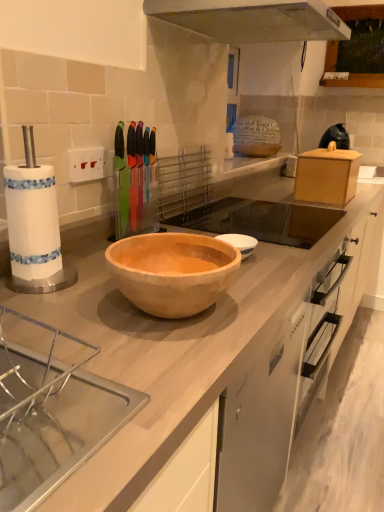
Image resolution: width=384 pixels, height=512 pixels. What do you see at coordinates (252, 19) in the screenshot? I see `stainless steel exhaust hood at upper center` at bounding box center [252, 19].

Based on the photo, what is the approximate width of stainless steel exhaust hood at upper center?

stainless steel exhaust hood at upper center is 20.89 inches in width.

What do you see at coordinates (51, 409) in the screenshot? This screenshot has height=512, width=384. I see `clear acrylic sink at lower left, marked as the 1th sink in a front-to-back arrangement` at bounding box center [51, 409].

The width and height of the screenshot is (384, 512). I want to click on stainless steel exhaust hood at upper center, so click(252, 19).

From the image's perspective, does clear acrylic sink at lower left, which is counted as the 1th sink, starting from the bottom, appear lower than stainless steel exhaust hood at upper center?

Yes, from the image's perspective, clear acrylic sink at lower left, which is counted as the 1th sink, starting from the bottom, is below stainless steel exhaust hood at upper center.

Is clear acrylic sink at lower left, which is counted as the 1th sink, starting from the bottom, thinner than stainless steel exhaust hood at upper center?

Indeed, clear acrylic sink at lower left, which is counted as the 1th sink, starting from the bottom, has a lesser width compared to stainless steel exhaust hood at upper center.

Can you confirm if clear acrylic sink at lower left, the first sink positioned from the left, is shorter than stainless steel exhaust hood at upper center?

Yes, clear acrylic sink at lower left, the first sink positioned from the left, is shorter than stainless steel exhaust hood at upper center.

In the scene shown: Which object is further away from the camera taking this photo, black plastic kettle at upper right or clear acrylic sink at lower left, marked as the 1th sink in a front-to-back arrangement?

black plastic kettle at upper right is behind.

How different are the orientations of black plastic kettle at upper right and clear acrylic sink at lower left, the second sink viewed from the back, in degrees?

The angle between the facing direction of black plastic kettle at upper right and the facing direction of clear acrylic sink at lower left, the second sink viewed from the back, is 53.5 degrees.

From the image's perspective, between black plastic kettle at upper right and clear acrylic sink at lower left, which is the second sink in right-to-left order, which one is located above?

black plastic kettle at upper right.

Is point (332, 226) closer or farther from the camera than point (60, 339)?

Clearly, point (332, 226) is more distant from the camera than point (60, 339).

You are a GUI agent. You are given a task and a screenshot of the screen. Output one action in this format:
    pyautogui.click(x=<x>, y=<y>)
    Task: Click on the sink that is under the clear acrylic sink at lower left, the first sink positioned from the left (from a real-world perspective)
    This screenshot has width=384, height=512.
    Given the screenshot: What is the action you would take?
    pyautogui.click(x=261, y=220)

Is wooden bowl at center, the 2th sink from the left, spatially inside clear acrylic sink at lower left, the first sink positioned from the left, or outside of it?

wooden bowl at center, the 2th sink from the left, is not inside clear acrylic sink at lower left, the first sink positioned from the left, it's outside.

From the image's perspective, which one is positioned higher, stainless steel exhaust hood at upper center or wooden bowl at center, the first sink in the right-to-left sequence?

stainless steel exhaust hood at upper center is shown above in the image.

Based on the photo, how different are the orientations of stainless steel exhaust hood at upper center and wooden bowl at center, arranged as the first sink when viewed from the top, in degrees?

The facing directions of stainless steel exhaust hood at upper center and wooden bowl at center, arranged as the first sink when viewed from the top, are 0.0707 degrees apart.

Could you tell me if stainless steel exhaust hood at upper center is facing wooden bowl at center, which ranks as the first sink in back-to-front order?

No.

Considering the points (204, 10) and (294, 223), which point is behind, point (204, 10) or point (294, 223)?

The point (294, 223) is behind.

How different are the orientations of clear acrylic sink at lower left, which is counted as the 2th sink, starting from the top, and wooden bowl at center, which ranks as the first sink in back-to-front order, in degrees?

The angle between the facing direction of clear acrylic sink at lower left, which is counted as the 2th sink, starting from the top, and the facing direction of wooden bowl at center, which ranks as the first sink in back-to-front order, is 0.595 degrees.

Considering the sizes of objects clear acrylic sink at lower left, the second sink viewed from the back, and wooden bowl at center, the second sink from the front, in the image provided, who is taller, clear acrylic sink at lower left, the second sink viewed from the back, or wooden bowl at center, the second sink from the front,?

clear acrylic sink at lower left, the second sink viewed from the back, is taller.

Which of these two, clear acrylic sink at lower left, which is counted as the 1th sink, starting from the bottom, or wooden bowl at center, the 2th sink from the left, is bigger?

With larger size is wooden bowl at center, the 2th sink from the left.

Is clear acrylic sink at lower left, marked as the 1th sink in a front-to-back arrangement, not close to wooden bowl at center, the first sink in the right-to-left sequence?

clear acrylic sink at lower left, marked as the 1th sink in a front-to-back arrangement, is near wooden bowl at center, the first sink in the right-to-left sequence, not far away.

From a real-world perspective, between wooden bowl at center, the second sink from the front, and black plastic kettle at upper right, who is vertically lower?

wooden bowl at center, the second sink from the front, is physically lower.

Is wooden bowl at center, arranged as the first sink when viewed from the top, spatially inside black plastic kettle at upper right, or outside of it?

wooden bowl at center, arranged as the first sink when viewed from the top, is outside black plastic kettle at upper right.

Is wooden bowl at center, the second sink from the front, aimed at black plastic kettle at upper right?

No, wooden bowl at center, the second sink from the front, is not oriented towards black plastic kettle at upper right.

Which object is wider, wooden bowl at center, the 2th sink from the left, or black plastic kettle at upper right?

Wider between the two is wooden bowl at center, the 2th sink from the left.

Looking at their sizes, would you say black plastic kettle at upper right is wider or thinner than wooden bowl at center, the 2th sink from the left?

Clearly, black plastic kettle at upper right has less width compared to wooden bowl at center, the 2th sink from the left.

From a real-world perspective, is black plastic kettle at upper right positioned above or below wooden bowl at center, arranged as the first sink when viewed from the top?

In terms of real-world spatial position, black plastic kettle at upper right is above wooden bowl at center, arranged as the first sink when viewed from the top.

Is black plastic kettle at upper right inside the boundaries of wooden bowl at center, the first sink in the right-to-left sequence, or outside?

The correct answer is: outside.

From the image's perspective, which sink is the 2nd one below the stainless steel exhaust hood at upper center? Please provide its 2D coordinates.

[(51, 409)]

Image resolution: width=384 pixels, height=512 pixels. Find the location of `appliance on the right of clear acrylic sink at lower left, which is the second sink in right-to-left order`. appliance on the right of clear acrylic sink at lower left, which is the second sink in right-to-left order is located at coordinates (335, 137).

From the image, which object appears to be farther from black plastic kettle at upper right, stainless steel exhaust hood at upper center or wooden bowl at center, which ranks as the first sink in back-to-front order?

Based on the image, stainless steel exhaust hood at upper center appears to be further to black plastic kettle at upper right.

Looking at the image, which one is located further to stainless steel exhaust hood at upper center, black plastic kettle at upper right or clear acrylic sink at lower left, the second sink viewed from the back?

clear acrylic sink at lower left, the second sink viewed from the back.

Consider the image. When comparing their distances from clear acrylic sink at lower left, the second sink viewed from the back, does wooden bowl at center, the first sink in the right-to-left sequence, or stainless steel exhaust hood at upper center seem closer?

Among the two, wooden bowl at center, the first sink in the right-to-left sequence, is located nearer to clear acrylic sink at lower left, the second sink viewed from the back.

Based on their spatial positions, is clear acrylic sink at lower left, which is counted as the 1th sink, starting from the bottom, or wooden bowl at center, acting as the second sink starting from the bottom, further from black plastic kettle at upper right?

clear acrylic sink at lower left, which is counted as the 1th sink, starting from the bottom, is further to black plastic kettle at upper right.

Considering their positions, is stainless steel exhaust hood at upper center positioned further to wooden bowl at center, arranged as the first sink when viewed from the top, than clear acrylic sink at lower left, the second sink viewed from the back?

Based on the image, clear acrylic sink at lower left, the second sink viewed from the back, appears to be further to wooden bowl at center, arranged as the first sink when viewed from the top.

From the image, which object appears to be nearer to clear acrylic sink at lower left, the first sink positioned from the left, stainless steel exhaust hood at upper center or black plastic kettle at upper right?

stainless steel exhaust hood at upper center lies closer to clear acrylic sink at lower left, the first sink positioned from the left, than the other object.

Estimate the real-world distances between objects in this image. Which object is closer to wooden bowl at center, the second sink from the front, clear acrylic sink at lower left, which is the second sink in right-to-left order, or black plastic kettle at upper right?

Among the two, clear acrylic sink at lower left, which is the second sink in right-to-left order, is located nearer to wooden bowl at center, the second sink from the front.

Which object lies further to the anchor point stainless steel exhaust hood at upper center, wooden bowl at center, the first sink in the right-to-left sequence, or clear acrylic sink at lower left, the first sink positioned from the left?

clear acrylic sink at lower left, the first sink positioned from the left, is positioned further to the anchor stainless steel exhaust hood at upper center.

Where is `sink between stainless steel exhaust hood at upper center and clear acrylic sink at lower left, marked as the 1th sink in a front-to-back arrangement, from top to bottom`? sink between stainless steel exhaust hood at upper center and clear acrylic sink at lower left, marked as the 1th sink in a front-to-back arrangement, from top to bottom is located at coordinates (261, 220).

You are a GUI agent. You are given a task and a screenshot of the screen. Output one action in this format:
    pyautogui.click(x=<x>, y=<y>)
    Task: Click on the sink positioned between stainless steel exhaust hood at upper center and black plastic kettle at upper right from near to far
    The height and width of the screenshot is (512, 384).
    Given the screenshot: What is the action you would take?
    pyautogui.click(x=261, y=220)

This screenshot has width=384, height=512. Identify the location of exhaust hood between clear acrylic sink at lower left, the second sink viewed from the back, and black plastic kettle at upper right from front to back. (252, 19).

In order to click on sink positioned between clear acrylic sink at lower left, marked as the 1th sink in a front-to-back arrangement, and black plastic kettle at upper right from near to far in this screenshot , I will do tap(261, 220).